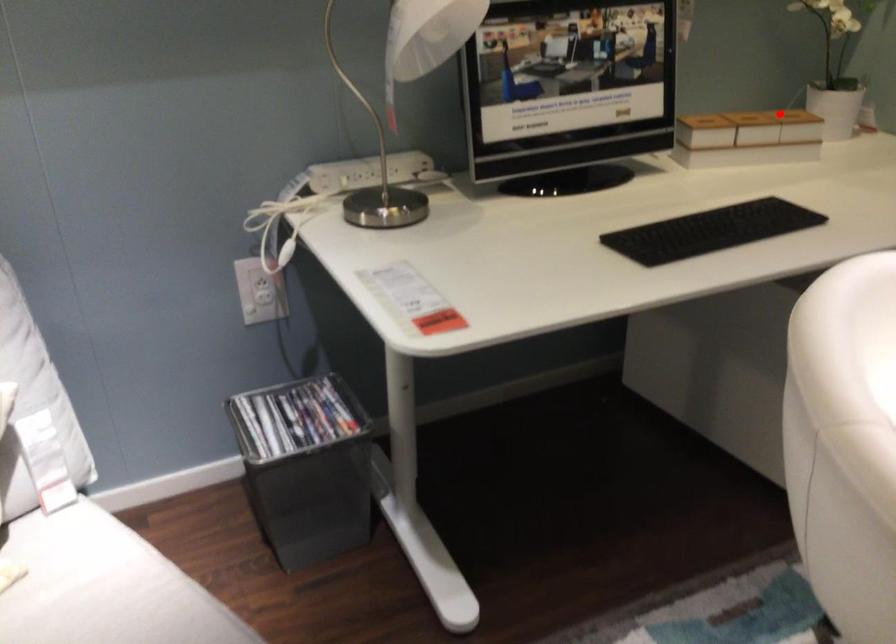
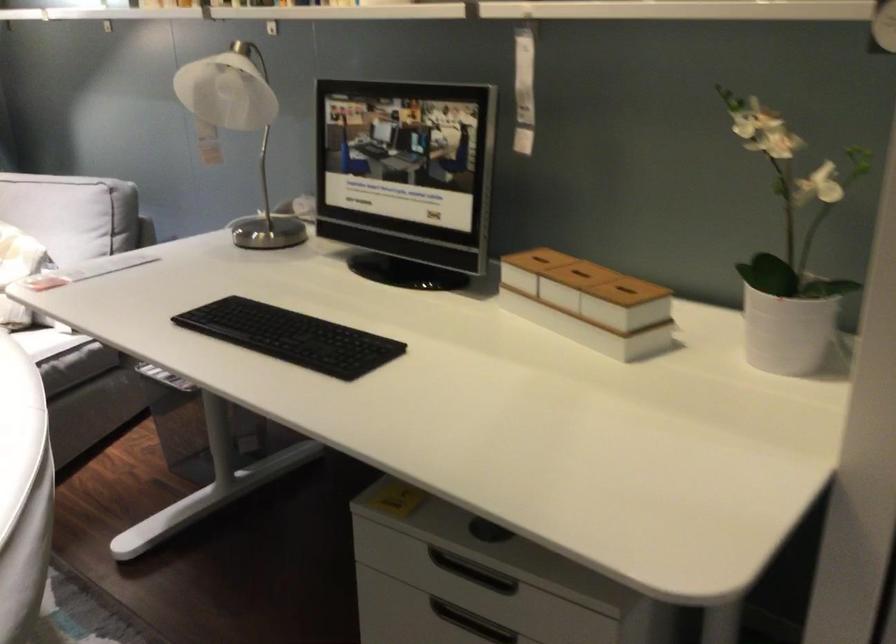
Question: I am providing you with two images of the same scene from different viewpoints. In image1, a red point is highlighted. Considering the same 3D point in image2, which of the following is correct?

Choices:
 (A) It is closer
 (B) It is farther

Answer: (A)